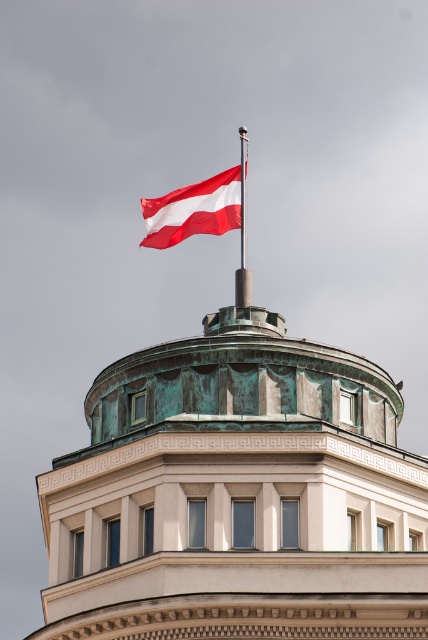
Consider the image. You are an architect examining the dome structure. You notice two points marked on the dome surface. Which of the two points, point (231,180) or point (244,152), is closer to you?

Point (231,180) is closer to the viewer than point (244,152).

You are a maintenance worker needing to replace the red fabric flag at upper center. You have a ladder that is 20 feet long. The red flagpole at top is in your way. Can you safely reach the flag without the ladder touching the flagpole?

The red fabric flag at upper center and red flagpole at top are 20.65 feet apart. Since the ladder is only 20 feet long, it would not be long enough to reach the flag without touching the flagpole, posing a safety risk. Therefore, you cannot safely reach the flag with the current ladder.

You are an architect examining the building design. You notice a point at coordinates (195, 209). What object is located at this point?

The point at coordinates (195, 209) is occupied by the red fabric flag at upper center.